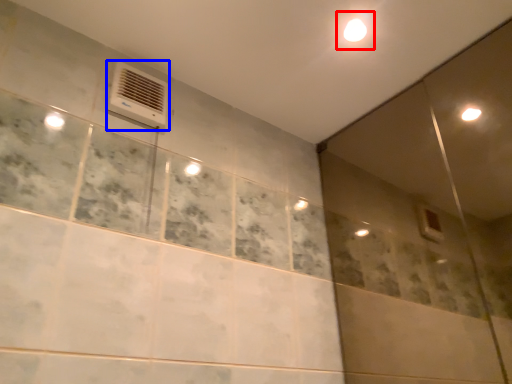
Question: Which object is further to the camera taking this photo, light (highlighted by a red box) or air conditioning (highlighted by a blue box)?

Choices:
 (A) light
 (B) air conditioning

Answer: (A)